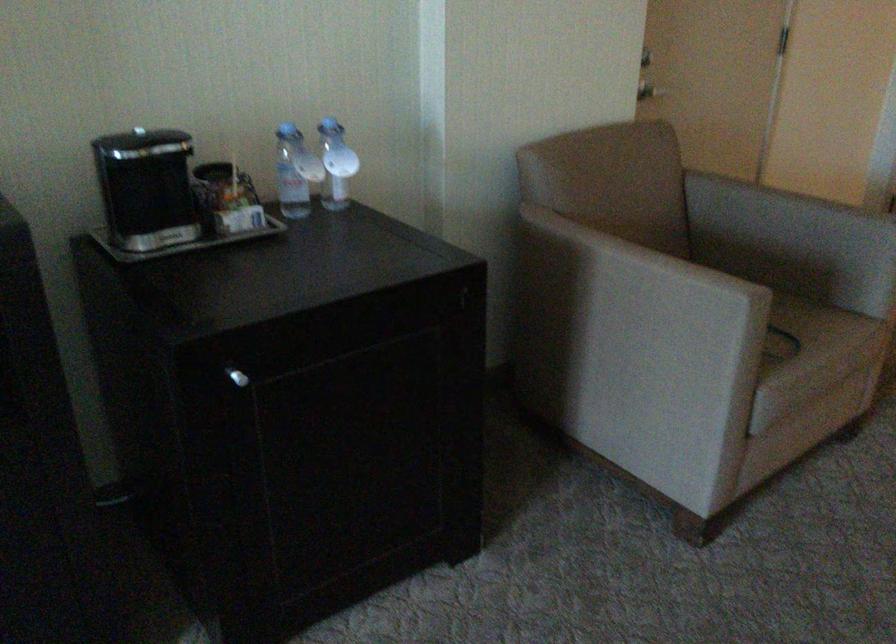
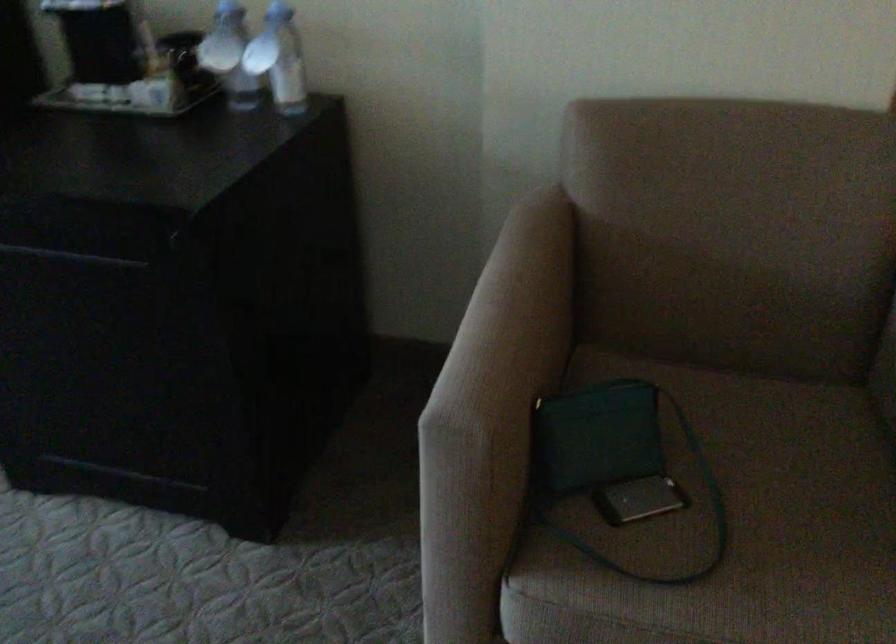
Locate, in the second image, the point that corresponds to pixel 730 274 in the first image.

(495, 390)